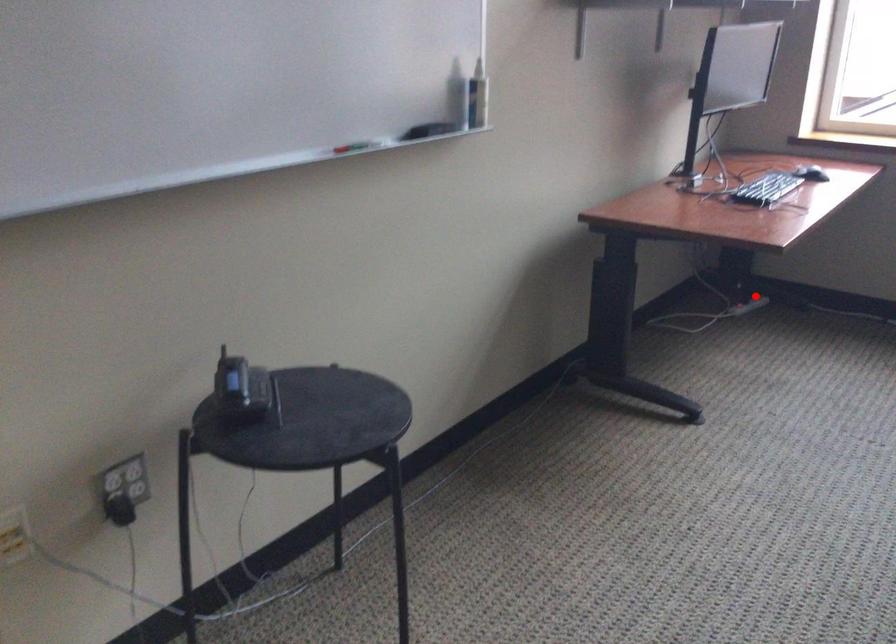
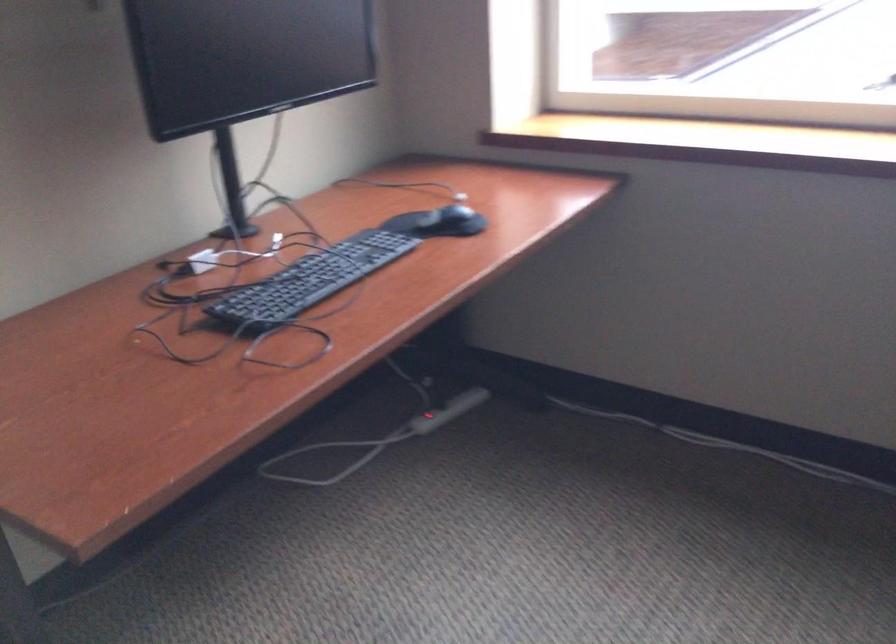
Question: I am providing you with two images of the same scene from different viewpoints. Image1 has a red point marked. In image2, the corresponding 3D location appears at what relative position? Reply with the corresponding letter.

Choices:
 (A) Closer
 (B) Farther

Answer: (A)